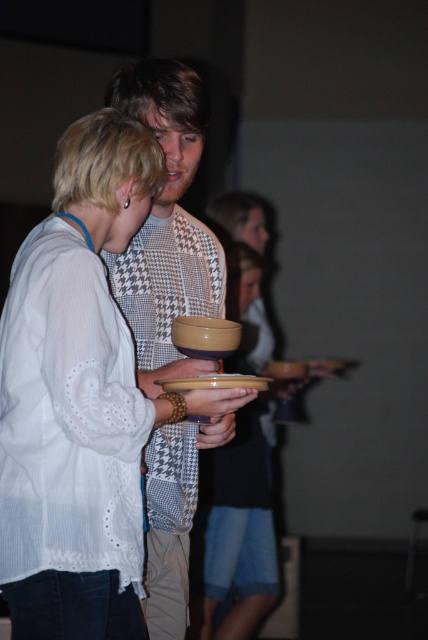
Question: Estimate the real-world distances between objects in this image. Which object is closer to the matte ceramic plate at center?

Choices:
 (A) houndstooth fabric shirt at center
 (B) matte yellow bowl at center

Answer: (B)

Question: Can you confirm if houndstooth fabric shirt at center is positioned to the right of matte ceramic plate at center?

Choices:
 (A) yes
 (B) no

Answer: (B)

Question: Is houndstooth fabric shirt at center wider than matte yellow bowl at center?

Choices:
 (A) yes
 (B) no

Answer: (A)

Question: Which of these objects is positioned closest to the houndstooth fabric shirt at center?

Choices:
 (A) matte yellow bowl at center
 (B) matte ceramic plate at center

Answer: (A)

Question: Does matte yellow bowl at center appear on the right side of matte ceramic plate at center?

Choices:
 (A) yes
 (B) no

Answer: (B)

Question: Which object is positioned closest to the houndstooth fabric shirt at center?

Choices:
 (A) matte yellow bowl at center
 (B) matte ceramic plate at center

Answer: (A)